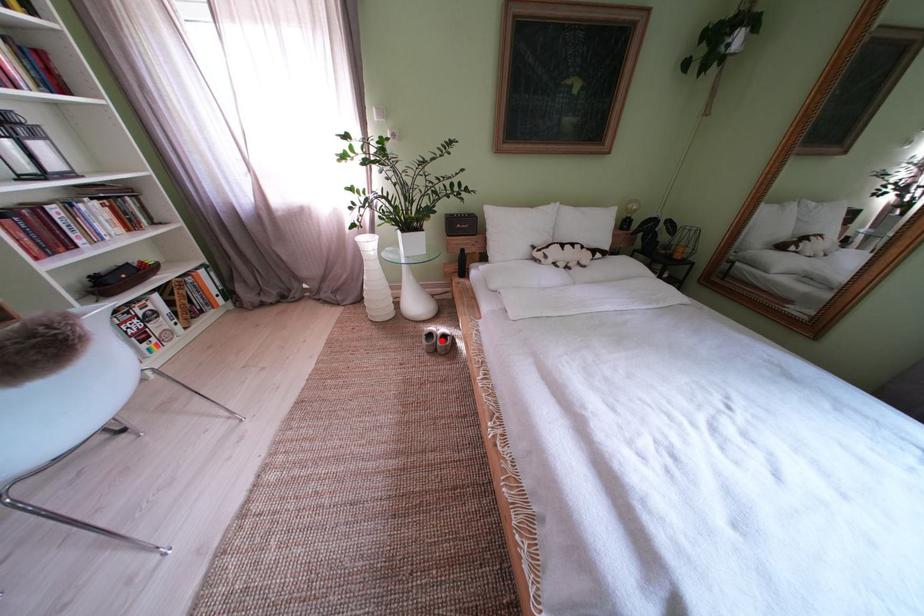
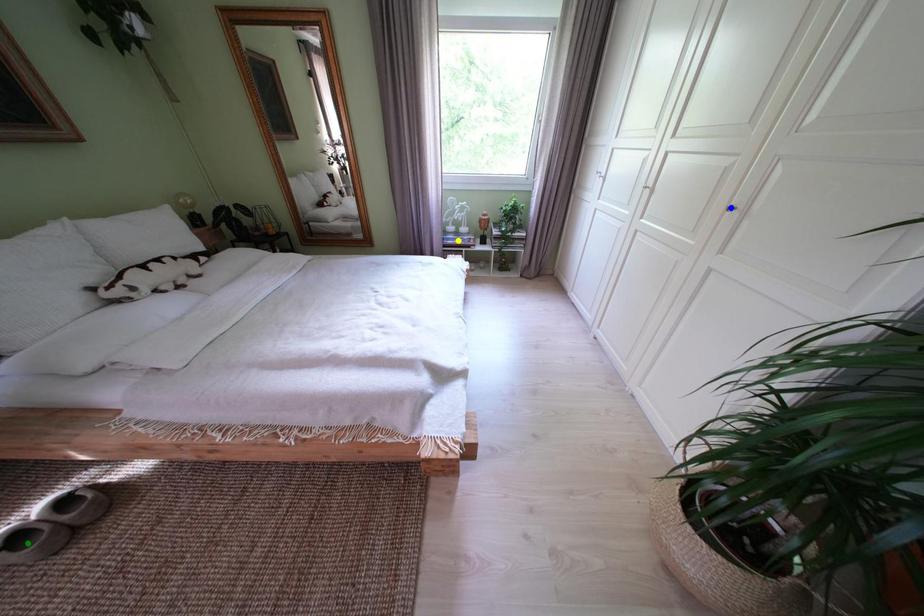
Question: I am providing you with two images of the same scene from different viewpoints. A red point is marked on the first image. You are given multiple points on the second image. Which spot in image 2 lines up with the point in image 1?

Choices:
 (A) yellow point
 (B) green point
 (C) blue point

Answer: (B)